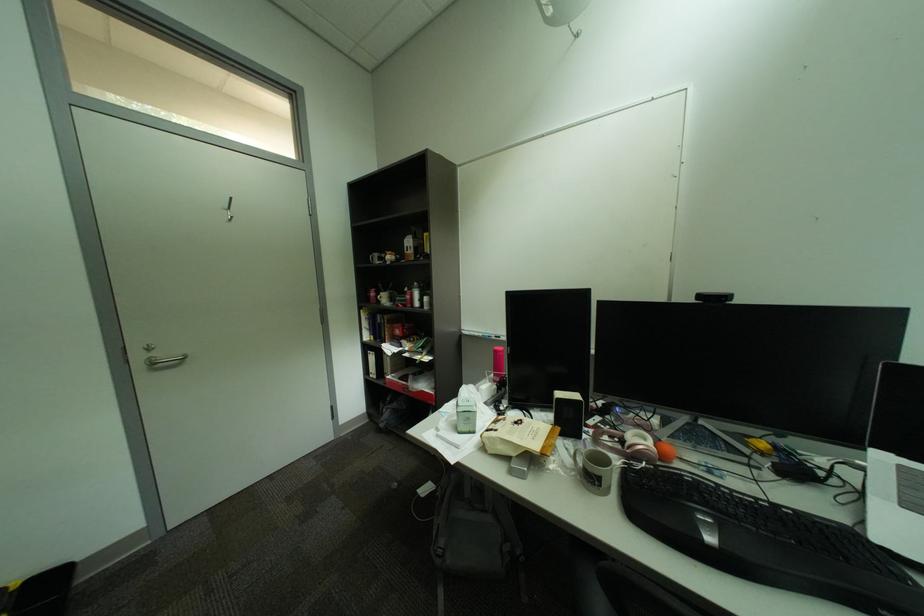
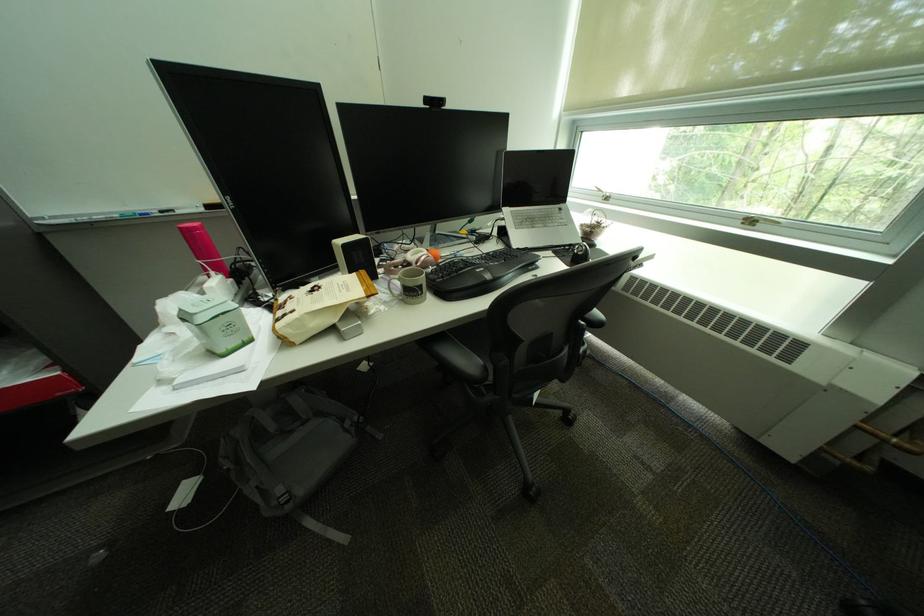
The point at (x=450, y=562) is marked in the first image. Where is the corresponding point in the second image?

(299, 508)